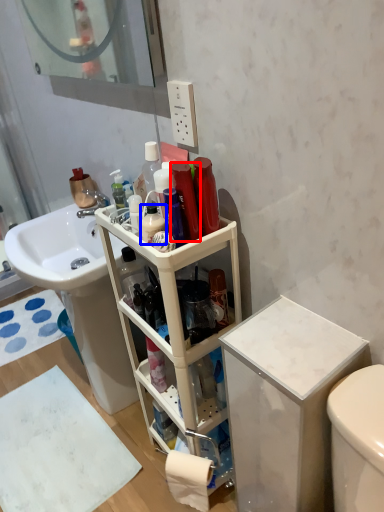
Question: Which of the following is the farthest to the observer, toiletry (highlighted by a red box) or cleaning product (highlighted by a blue box)?

Choices:
 (A) toiletry
 (B) cleaning product

Answer: (B)